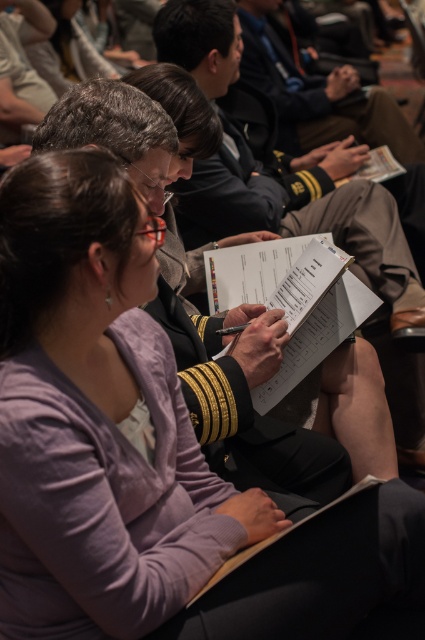
Question: Does white paper clipboard at center lie behind navy blue uniform at upper center?

Choices:
 (A) yes
 (B) no

Answer: (B)

Question: Based on their relative distances, which object is farther from the white paper clipboard at center?

Choices:
 (A) uniformed officer at center
 (B) navy blue uniform at upper center

Answer: (B)

Question: Is white paper clipboard at center below navy blue uniform at upper center?

Choices:
 (A) no
 (B) yes

Answer: (B)

Question: From the image, what is the correct spatial relationship of white paper clipboard at center in relation to navy blue uniform at upper center?

Choices:
 (A) left
 (B) right

Answer: (A)

Question: Which is nearer to the navy blue uniform at upper center?

Choices:
 (A) uniformed officer at center
 (B) white paper clipboard at center

Answer: (A)

Question: Which object is the closest to the white paper clipboard at center?

Choices:
 (A) uniformed officer at center
 (B) navy blue uniform at upper center

Answer: (A)